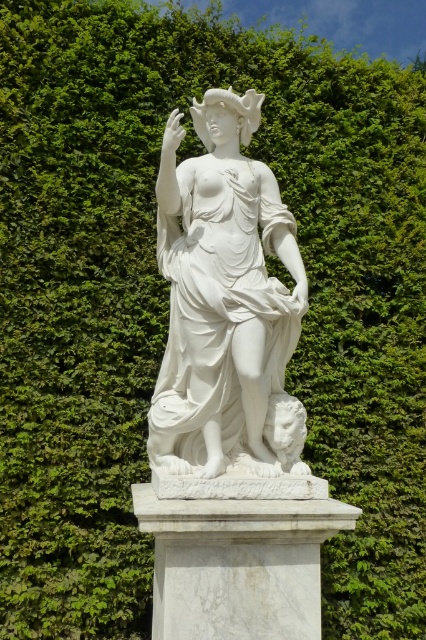
Question: Does white marble statue at center have a lesser width compared to white marble pedestal at center?

Choices:
 (A) yes
 (B) no

Answer: (A)

Question: Is white marble statue at center thinner than white marble pedestal at center?

Choices:
 (A) yes
 (B) no

Answer: (A)

Question: Is white marble statue at center behind white marble pedestal at center?

Choices:
 (A) no
 (B) yes

Answer: (B)

Question: Which point is closer to the camera?

Choices:
 (A) white marble pedestal at center
 (B) white marble statue at center

Answer: (A)